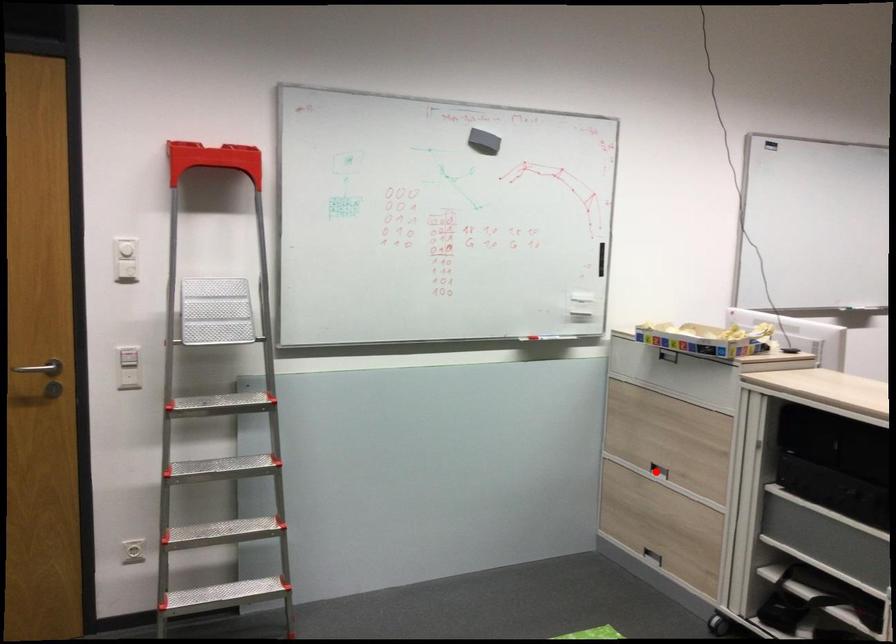
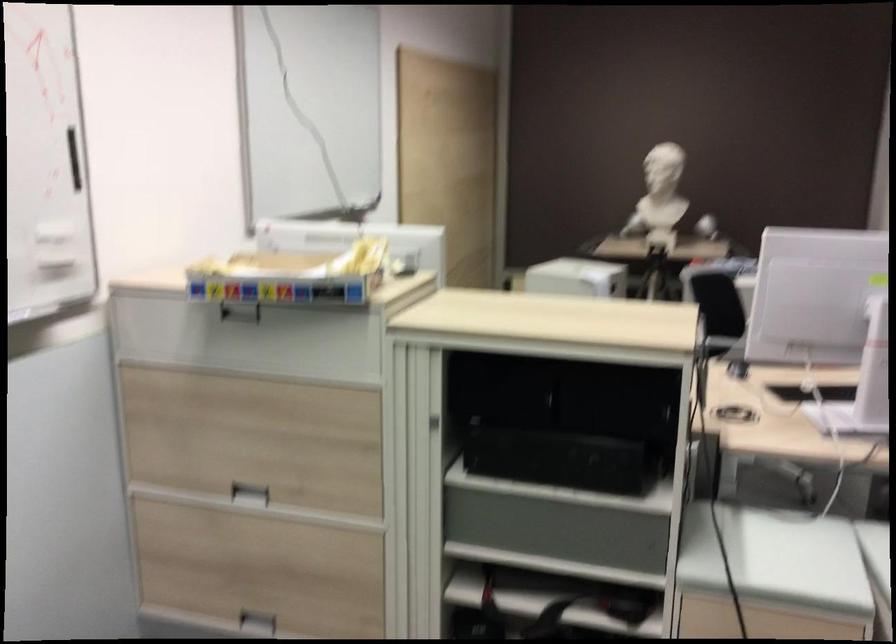
Question: A red point is marked in image1. In image2, is the corresponding 3D point closer to the camera or farther? Reply with the corresponding letter.

Choices:
 (A) The corresponding 3D point is closer.
 (B) The corresponding 3D point is farther.

Answer: (A)